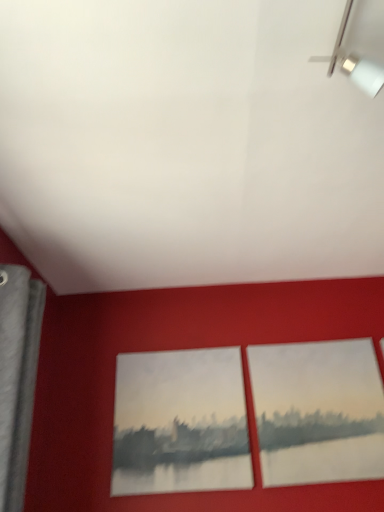
Question: Which direction should I rotate to face matte red picture frame at center, placed as the first picture frame when sorted from right to left, — up or down?

Choices:
 (A) up
 (B) down

Answer: (B)

Question: Is matte red picture frame at center, which appears as the second picture frame when viewed from the left, wider than matte canvas painting at center, which ranks as the 1th picture frame in left-to-right order?

Choices:
 (A) yes
 (B) no

Answer: (A)

Question: From a real-world perspective, is matte red picture frame at center, which appears as the second picture frame when viewed from the left, under matte canvas painting at center, which ranks as the 1th picture frame in left-to-right order?

Choices:
 (A) no
 (B) yes

Answer: (A)

Question: Is matte red picture frame at center, which appears as the second picture frame when viewed from the left, to the left of matte canvas painting at center, placed as the 2th picture frame when sorted from right to left, from the viewer's perspective?

Choices:
 (A) no
 (B) yes

Answer: (A)

Question: Does matte red picture frame at center, which appears as the second picture frame when viewed from the left, have a lesser height compared to matte canvas painting at center, placed as the 2th picture frame when sorted from right to left?

Choices:
 (A) no
 (B) yes

Answer: (A)

Question: Can we say matte red picture frame at center, which appears as the second picture frame when viewed from the left, lies outside matte canvas painting at center, which ranks as the 1th picture frame in left-to-right order?

Choices:
 (A) yes
 (B) no

Answer: (A)

Question: Does matte red picture frame at center, which appears as the second picture frame when viewed from the left, appear on the right side of matte canvas painting at center, which ranks as the 1th picture frame in left-to-right order?

Choices:
 (A) yes
 (B) no

Answer: (A)

Question: Is matte canvas painting at center, placed as the 2th picture frame when sorted from right to left, not within matte red picture frame at center, which appears as the second picture frame when viewed from the left?

Choices:
 (A) no
 (B) yes

Answer: (B)

Question: From a real-world perspective, is matte canvas painting at center, which ranks as the 1th picture frame in left-to-right order, located higher than matte red picture frame at center, which appears as the second picture frame when viewed from the left?

Choices:
 (A) no
 (B) yes

Answer: (A)

Question: Considering the relative positions of matte canvas painting at center, placed as the 2th picture frame when sorted from right to left, and matte red picture frame at center, which appears as the second picture frame when viewed from the left, in the image provided, is matte canvas painting at center, placed as the 2th picture frame when sorted from right to left, to the right of matte red picture frame at center, which appears as the second picture frame when viewed from the left, from the viewer's perspective?

Choices:
 (A) no
 (B) yes

Answer: (A)

Question: From the image's perspective, would you say matte canvas painting at center, placed as the 2th picture frame when sorted from right to left, is shown under matte red picture frame at center, placed as the first picture frame when sorted from right to left?

Choices:
 (A) no
 (B) yes

Answer: (B)

Question: Considering the relative sizes of matte canvas painting at center, which ranks as the 1th picture frame in left-to-right order, and matte red picture frame at center, placed as the first picture frame when sorted from right to left, in the image provided, is matte canvas painting at center, which ranks as the 1th picture frame in left-to-right order, shorter than matte red picture frame at center, placed as the first picture frame when sorted from right to left,?

Choices:
 (A) no
 (B) yes

Answer: (B)

Question: Is matte red picture frame at center, which appears as the second picture frame when viewed from the left, at the back of matte canvas painting at center, which ranks as the 1th picture frame in left-to-right order?

Choices:
 (A) no
 (B) yes

Answer: (A)

Question: From the image's perspective, relative to matte red picture frame at center, which appears as the second picture frame when viewed from the left, is matte canvas painting at center, placed as the 2th picture frame when sorted from right to left, above or below?

Choices:
 (A) above
 (B) below

Answer: (B)